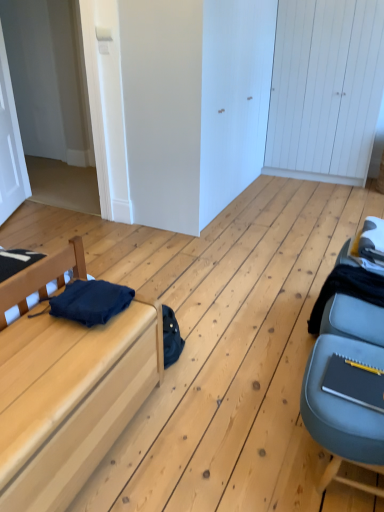
Question: Is the position of white wooden door at upper right, the first door from the back, more distant than that of matte wood bed at left?

Choices:
 (A) no
 (B) yes

Answer: (B)

Question: Is white wooden door at upper right, positioned as the 2th door in left-to-right order, outside of matte wood bed at left?

Choices:
 (A) no
 (B) yes

Answer: (B)

Question: Is white wooden door at upper right, the first door from the back, facing towards matte wood bed at left?

Choices:
 (A) no
 (B) yes

Answer: (B)

Question: Considering the relative positions of white wooden door at upper right, which is counted as the first door, starting from the right, and matte wood bed at left in the image provided, is white wooden door at upper right, which is counted as the first door, starting from the right, to the left of matte wood bed at left from the viewer's perspective?

Choices:
 (A) yes
 (B) no

Answer: (B)

Question: From a real-world perspective, is white wooden door at upper right, the second door viewed from the front, on top of matte wood bed at left?

Choices:
 (A) yes
 (B) no

Answer: (A)

Question: From the image's perspective, is matte wood bed at left located above or below white matte door at upper left, the 2th door from the right?

Choices:
 (A) above
 (B) below

Answer: (B)

Question: In the image, is matte wood bed at left positioned in front of or behind white matte door at upper left, the 2th door from the right?

Choices:
 (A) front
 (B) behind

Answer: (A)

Question: Would you say matte wood bed at left is to the left or to the right of white matte door at upper left, which is the 2th door from back to front, in the picture?

Choices:
 (A) right
 (B) left

Answer: (A)

Question: From a real-world perspective, is matte wood bed at left physically located above or below white matte door at upper left, the first door in the left-to-right sequence?

Choices:
 (A) above
 (B) below

Answer: (B)

Question: From a real-world perspective, is matte wood bed at left above or below dark blue fabric at left, the first clothing in the front-to-back sequence?

Choices:
 (A) above
 (B) below

Answer: (B)

Question: Based on their positions, is matte wood bed at left located to the left or right of dark blue fabric at left, which is the 1th clothing from left to right?

Choices:
 (A) right
 (B) left

Answer: (B)

Question: Looking at the image, does matte wood bed at left seem bigger or smaller compared to dark blue fabric at left, which is the 1th clothing from left to right?

Choices:
 (A) small
 (B) big

Answer: (B)

Question: Considering their positions, is matte wood bed at left located in front of or behind dark blue fabric at left, which is the 1th clothing from left to right?

Choices:
 (A) front
 (B) behind

Answer: (A)

Question: Considering the positions of white wooden door at upper right, the second door viewed from the front, and matte wood bed at left in the image, is white wooden door at upper right, the second door viewed from the front, bigger or smaller than matte wood bed at left?

Choices:
 (A) big
 (B) small

Answer: (A)

Question: Considering their positions, is white wooden door at upper right, which is counted as the first door, starting from the right, located in front of or behind matte wood bed at left?

Choices:
 (A) front
 (B) behind

Answer: (B)